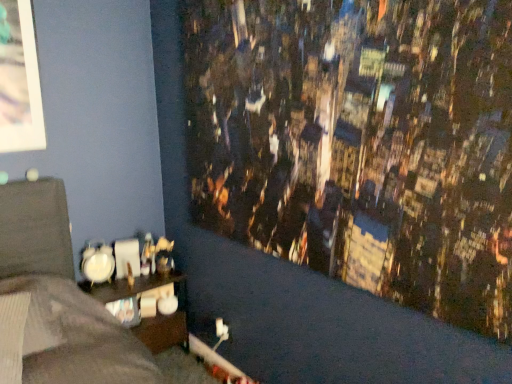
This screenshot has width=512, height=384. What do you see at coordinates (156, 307) in the screenshot? I see `wooden shelf at lower left` at bounding box center [156, 307].

Where is `wooden shelf at lower left`? wooden shelf at lower left is located at coordinates (156, 307).

What is the approximate height of wooden shelf at lower left?

It is 21.81 inches.

In order to face wooden shelf at lower left, should I rotate leftwards or rightwards?

Turn left by 15.225 degrees to look at wooden shelf at lower left.

Where is `wooden shelf at lower left`? This screenshot has height=384, width=512. wooden shelf at lower left is located at coordinates (156, 307).